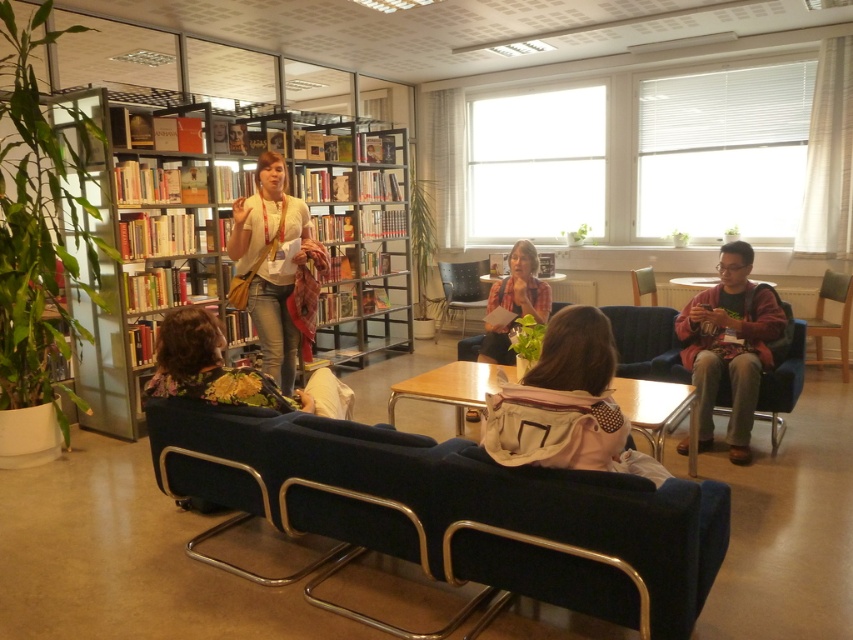
Is velvet dark blue couch at center positioned at the back of light brown wooden table at center?

No, velvet dark blue couch at center is closer to the viewer.

Does velvet dark blue couch at center have a smaller size compared to light brown wooden table at center?

Incorrect, velvet dark blue couch at center is not smaller in size than light brown wooden table at center.

Is point (260, 483) farther from viewer compared to point (639, 388)?

No, it is in front of (639, 388).

Find the location of a particular element. The height and width of the screenshot is (640, 853). velvet dark blue couch at center is located at coordinates (456, 508).

Can you confirm if beige fabric backpack at center is wider than metallic silver armchair at center?

Yes, beige fabric backpack at center is wider than metallic silver armchair at center.

Between point (606, 456) and point (444, 300), which one is positioned behind?

The point (444, 300) is more distant.

Find the location of a particular element. This screenshot has height=640, width=853. beige fabric backpack at center is located at coordinates (566, 404).

Is brown fabric jacket at right to the right of velvet blue armchair at right from the viewer's perspective?

In fact, brown fabric jacket at right is to the left of velvet blue armchair at right.

Which is behind, point (708, 314) or point (837, 324)?

Positioned behind is point (837, 324).

Image resolution: width=853 pixels, height=640 pixels. What are the coordinates of `brown fabric jacket at right` in the screenshot? It's located at (729, 344).